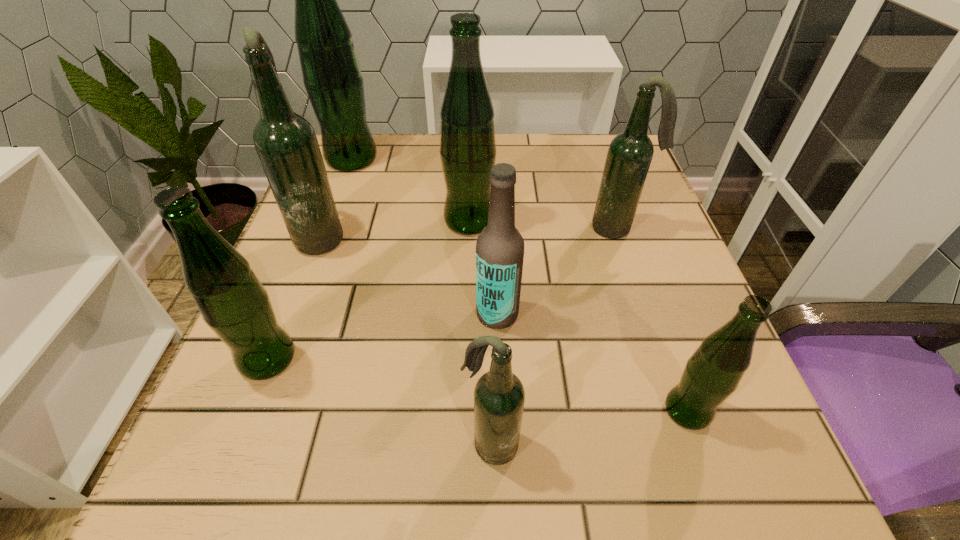
I want to click on vacant area at the far left corner of the desktop, so click(x=342, y=177).

Locate an element on the screen. free region at the near left corner of the desktop is located at coordinates (300, 478).

You are a GUI agent. You are given a task and a screenshot of the screen. Output one action in this format:
    pyautogui.click(x=<x>, y=<y>)
    Task: Click on the free region at the far right corner of the desktop
    The image size is (960, 540).
    Given the screenshot: What is the action you would take?
    pyautogui.click(x=587, y=138)

Locate an element on the screen. unoccupied area between the leftmost dark beer bottle and the second farthest green beer bottle is located at coordinates (396, 228).

You are a GUI agent. You are given a task and a screenshot of the screen. Output one action in this format:
    pyautogui.click(x=<x>, y=<y>)
    Task: Click on the free spot between the nearest dark beer bottle and the biggest dark beer bottle
    
    Given the screenshot: What is the action you would take?
    (406, 340)

Locate an element on the screen. The image size is (960, 540). unoccupied position between the sixth farthest object and the second dark beer bottle from right to left is located at coordinates tap(379, 402).

The height and width of the screenshot is (540, 960). Find the location of `free space between the third green beer bottle from left to right and the third biggest green beer bottle`. free space between the third green beer bottle from left to right and the third biggest green beer bottle is located at coordinates [369, 290].

Find the location of `unoccupied area between the biggest dark beer bottle and the third smallest green beer bottle`. unoccupied area between the biggest dark beer bottle and the third smallest green beer bottle is located at coordinates (396, 228).

At what (x,y) coordinates should I click in order to perform the action: click on vacant region between the third nearest green beer bottle and the third nearest object. Please return your answer as a coordinate pair (x, y). Image resolution: width=960 pixels, height=540 pixels. Looking at the image, I should click on (369, 290).

At what (x,y) coordinates should I click in order to perform the action: click on unoccupied area between the biggest dark beer bottle and the nearest dark beer bottle. Please return your answer as a coordinate pair (x, y). The image size is (960, 540). Looking at the image, I should click on [406, 340].